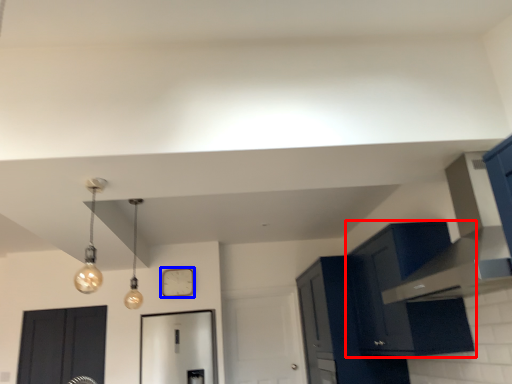
Question: Which of the following is the farthest to the observer, cabinetry (highlighted by a red box) or clock (highlighted by a blue box)?

Choices:
 (A) cabinetry
 (B) clock

Answer: (B)